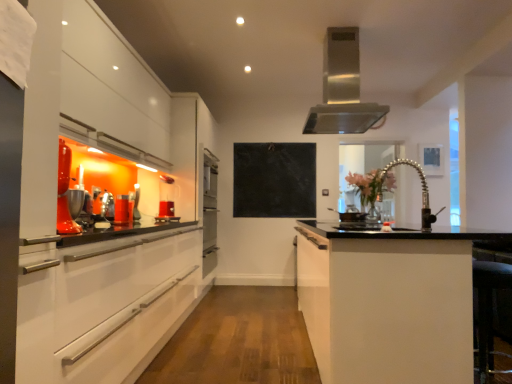
Question: From the image's perspective, is translucent glass vase at center on satin nickel faucet at center?

Choices:
 (A) no
 (B) yes

Answer: (B)

Question: Does translucent glass vase at center have a larger size compared to satin nickel faucet at center?

Choices:
 (A) no
 (B) yes

Answer: (B)

Question: From a real-world perspective, does translucent glass vase at center sit lower than satin nickel faucet at center?

Choices:
 (A) yes
 (B) no

Answer: (B)

Question: Considering the relative sizes of translucent glass vase at center and satin nickel faucet at center in the image provided, is translucent glass vase at center smaller than satin nickel faucet at center?

Choices:
 (A) yes
 (B) no

Answer: (B)

Question: Is translucent glass vase at center thinner than satin nickel faucet at center?

Choices:
 (A) yes
 (B) no

Answer: (B)

Question: Considering the positions of point (309, 178) and point (393, 213), is point (309, 178) closer or farther from the camera than point (393, 213)?

Choices:
 (A) farther
 (B) closer

Answer: (A)

Question: From the image's perspective, is black marble bulletin board at center positioned above or below translucent glass vase at center?

Choices:
 (A) below
 (B) above

Answer: (B)

Question: From a real-world perspective, is black marble bulletin board at center physically located above or below translucent glass vase at center?

Choices:
 (A) above
 (B) below

Answer: (A)

Question: Considering their positions, is black marble bulletin board at center located in front of or behind translucent glass vase at center?

Choices:
 (A) behind
 (B) front

Answer: (A)

Question: Is black marble bulletin board at center in front of or behind satin nickel faucet at center in the image?

Choices:
 (A) behind
 (B) front

Answer: (A)

Question: From the image's perspective, is black marble bulletin board at center above or below satin nickel faucet at center?

Choices:
 (A) above
 (B) below

Answer: (A)

Question: Is point (237, 155) closer or farther from the camera than point (390, 163)?

Choices:
 (A) farther
 (B) closer

Answer: (B)

Question: Is black marble bulletin board at center bigger or smaller than satin nickel faucet at center?

Choices:
 (A) big
 (B) small

Answer: (A)

Question: Does point (116, 211) appear closer or farther from the camera than point (347, 41)?

Choices:
 (A) closer
 (B) farther

Answer: (A)

Question: Is translucent glass cup at left, the 1th appliance viewed from the left, inside or outside of stainless steel range hood at upper center?

Choices:
 (A) inside
 (B) outside

Answer: (B)